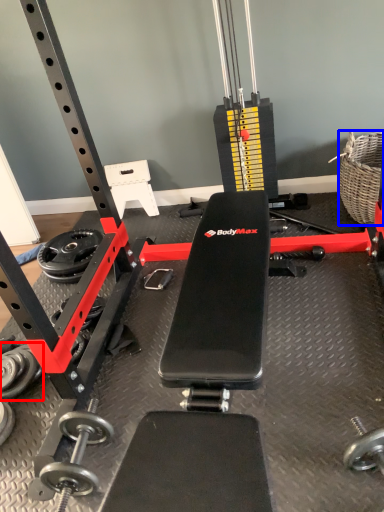
Question: Which of the following is the closest to the observer, dumbbell (highlighted by a red box) or basket (highlighted by a blue box)?

Choices:
 (A) dumbbell
 (B) basket

Answer: (A)